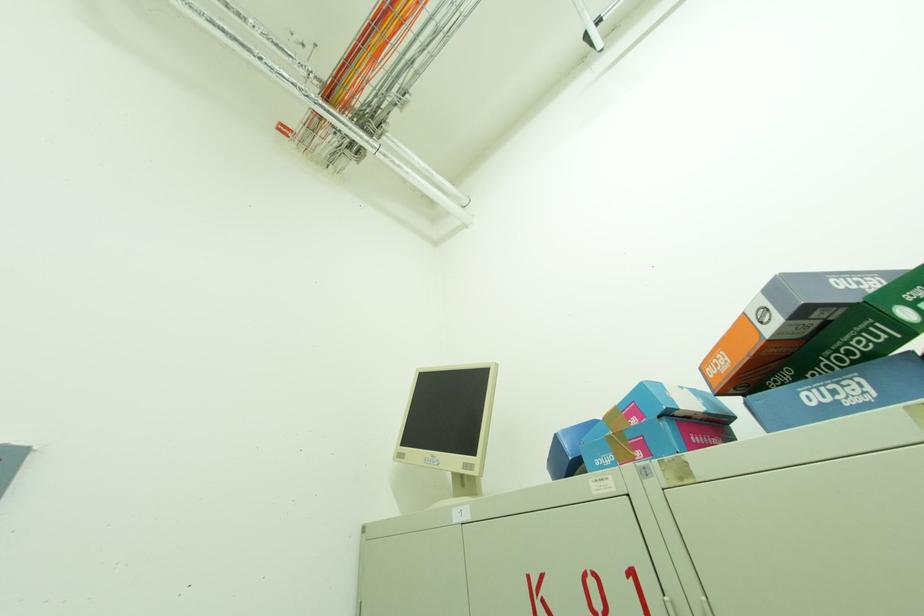
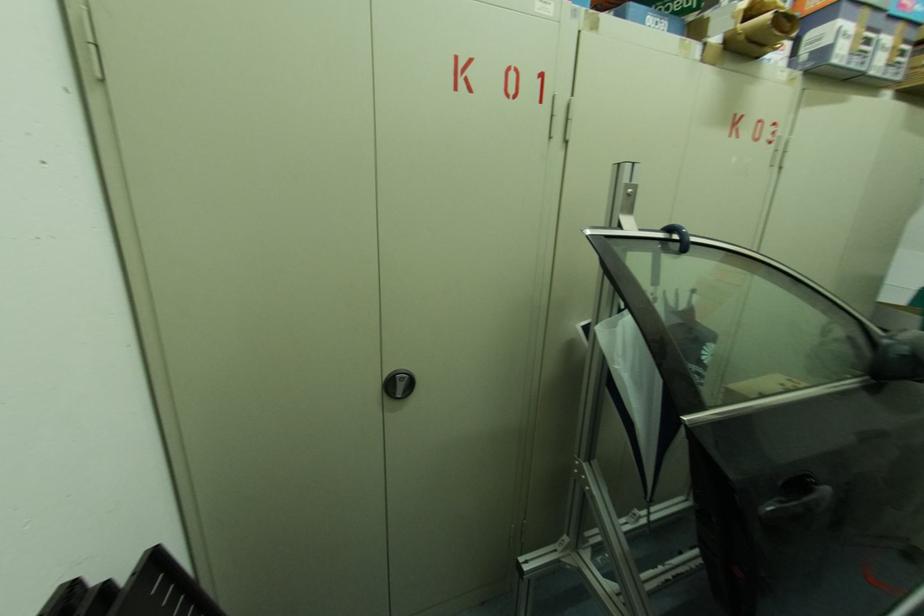
The first image is from the beginning of the video and the second image is from the end. How did the camera likely rotate when shooting the video?

The camera's rotation is toward right-down.